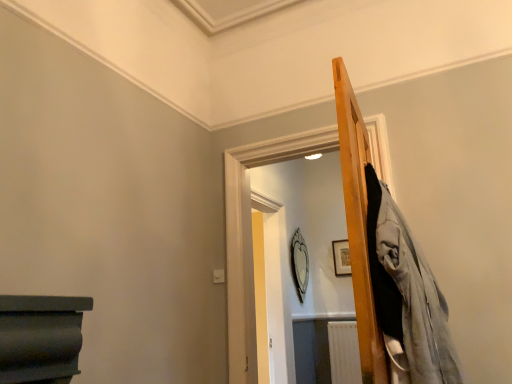
The height and width of the screenshot is (384, 512). What do you see at coordinates (341, 257) in the screenshot?
I see `wooden picture frame at upper right` at bounding box center [341, 257].

At what (x,y) coordinates should I click in order to perform the action: click on wooden picture frame at upper right. Please return your answer as a coordinate pair (x, y). This screenshot has width=512, height=384. Looking at the image, I should click on (341, 257).

Measure the distance between point (340,261) and camera.

4.67 meters.

Identify the location of silver metallic mirror at center. (298, 264).

Measure the distance between silver metallic mirror at center and camera.

They are 4.23 meters apart.

What is the approximate height of silver metallic mirror at center?

silver metallic mirror at center is 32.22 inches in height.

The height and width of the screenshot is (384, 512). Describe the element at coordinates (298, 264) in the screenshot. I see `silver metallic mirror at center` at that location.

Locate an element on the screen. wooden picture frame at upper right is located at coordinates (341, 257).

Which is more to the right, wooden picture frame at upper right or silver metallic mirror at center?

Positioned to the right is wooden picture frame at upper right.

Is the depth of wooden picture frame at upper right less than that of silver metallic mirror at center?

No.

Does point (346, 250) come behind point (298, 233)?

No, (346, 250) is closer to viewer.

From the image's perspective, which is above, wooden picture frame at upper right or silver metallic mirror at center?

wooden picture frame at upper right, from the image's perspective.

From a real-world perspective, between wooden picture frame at upper right and silver metallic mirror at center, who is vertically lower?

silver metallic mirror at center.

In terms of width, does wooden picture frame at upper right look wider or thinner when compared to silver metallic mirror at center?

Clearly, wooden picture frame at upper right has less width compared to silver metallic mirror at center.

Between wooden picture frame at upper right and silver metallic mirror at center, which one has more height?

silver metallic mirror at center is taller.

Consider the image. Considering the relative sizes of wooden picture frame at upper right and silver metallic mirror at center in the image provided, is wooden picture frame at upper right smaller than silver metallic mirror at center?

Yes.

Is silver metallic mirror at center located within wooden picture frame at upper right?

That's incorrect, silver metallic mirror at center is not inside wooden picture frame at upper right.

Are wooden picture frame at upper right and silver metallic mirror at center located far from each other?

No, there isn't a large distance between wooden picture frame at upper right and silver metallic mirror at center.

Is wooden picture frame at upper right facing away from silver metallic mirror at center?

That's not correct — wooden picture frame at upper right is not looking away from silver metallic mirror at center.

Locate an element on the screen. This screenshot has height=384, width=512. mirror below the wooden picture frame at upper right (from the image's perspective) is located at coordinates (298, 264).

Would you say silver metallic mirror at center is to the left or to the right of wooden picture frame at upper right in the picture?

In the image, silver metallic mirror at center appears on the left side of wooden picture frame at upper right.

Is silver metallic mirror at center behind wooden picture frame at upper right?

No.

Is point (292, 257) more distant than point (340, 241)?

No, (292, 257) is closer to viewer.

From the image's perspective, does silver metallic mirror at center appear lower than wooden picture frame at upper right?

Yes, from the image's perspective, silver metallic mirror at center is below wooden picture frame at upper right.

From a real-world perspective, is silver metallic mirror at center under wooden picture frame at upper right?

Indeed, from a real-world perspective, silver metallic mirror at center is positioned beneath wooden picture frame at upper right.

Which of these two, silver metallic mirror at center or wooden picture frame at upper right, is wider?

Wider between the two is silver metallic mirror at center.

Which of these two, silver metallic mirror at center or wooden picture frame at upper right, stands taller?

With more height is silver metallic mirror at center.

Is silver metallic mirror at center bigger than wooden picture frame at upper right?

Yes, silver metallic mirror at center is bigger than wooden picture frame at upper right.

Which is correct: silver metallic mirror at center is inside wooden picture frame at upper right, or outside of it?

The correct answer is: outside.

Would you say silver metallic mirror at center is a long distance from wooden picture frame at upper right?

No, silver metallic mirror at center is not far away from wooden picture frame at upper right.

Looking at this image, could you tell me if silver metallic mirror at center is facing wooden picture frame at upper right?

Yes, silver metallic mirror at center faces towards wooden picture frame at upper right.

Measure the distance from silver metallic mirror at center to wooden picture frame at upper right.

silver metallic mirror at center and wooden picture frame at upper right are 18.90 inches apart.

At what (x,y) coordinates should I click in order to perform the action: click on mirror below the wooden picture frame at upper right (from a real-world perspective). Please return your answer as a coordinate pair (x, y). This screenshot has height=384, width=512. Looking at the image, I should click on (298, 264).

At what (x,y) coordinates should I click in order to perform the action: click on mirror lying on the left of wooden picture frame at upper right. Please return your answer as a coordinate pair (x, y). Looking at the image, I should click on (298, 264).

Identify the location of picture frame above the silver metallic mirror at center (from the image's perspective). (341, 257).